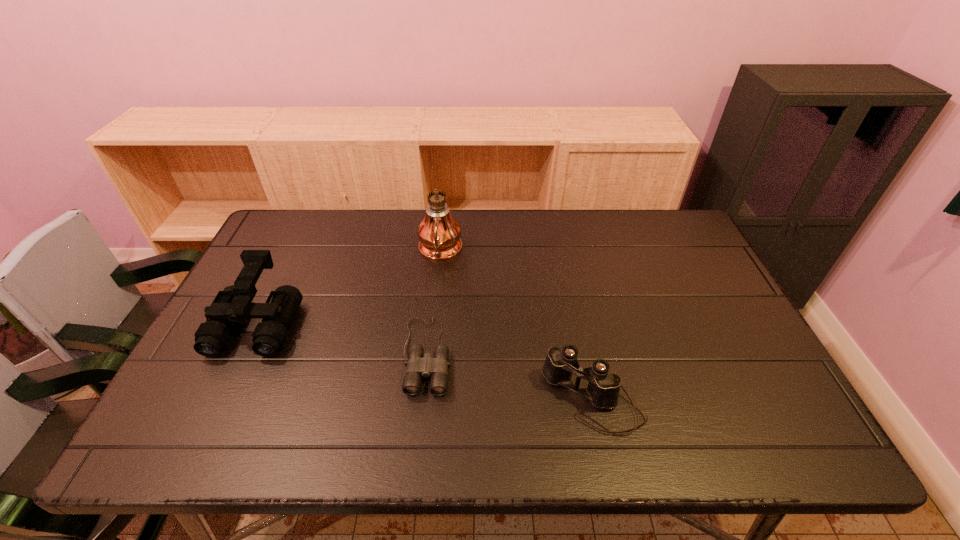
Locate which object is the second closest to the tallest object. Please provide its 2D coordinates. Your answer should be formatted as a tuple, i.e. [(x, y)], where the tuple contains the x and y coordinates of a point satisfying the conditions above.

[(232, 305)]

Locate which object is the second closest to the rightmost binoculars. Please provide its 2D coordinates. Your answer should be formatted as a tuple, i.e. [(x, y)], where the tuple contains the x and y coordinates of a point satisfying the conditions above.

[(439, 233)]

In order to click on the closest binoculars to the oil lamp in this screenshot , I will do `click(418, 366)`.

Select which binoculars appears as the closest to the farthest object. Please provide its 2D coordinates. Your answer should be formatted as a tuple, i.e. [(x, y)], where the tuple contains the x and y coordinates of a point satisfying the conditions above.

[(418, 366)]

Image resolution: width=960 pixels, height=540 pixels. I want to click on free space that satisfies the following two spatial constraints: 1. on the front lenses of the leftmost binoculars; 2. on the right side of the rightmost object, so click(221, 400).

Find the location of a particular element. Image resolution: width=960 pixels, height=540 pixels. vacant region that satisfies the following two spatial constraints: 1. on the front lenses of the leftmost binoculars; 2. on the left side of the rightmost binoculars is located at coordinates (221, 400).

The height and width of the screenshot is (540, 960). I want to click on blank space that satisfies the following two spatial constraints: 1. on the front side of the oil lamp; 2. on the left side of the second shortest binoculars, so click(424, 400).

I want to click on free space that satisfies the following two spatial constraints: 1. at the eyepiece of the second shortest object; 2. on the right side of the second binoculars from right to left, so click(422, 400).